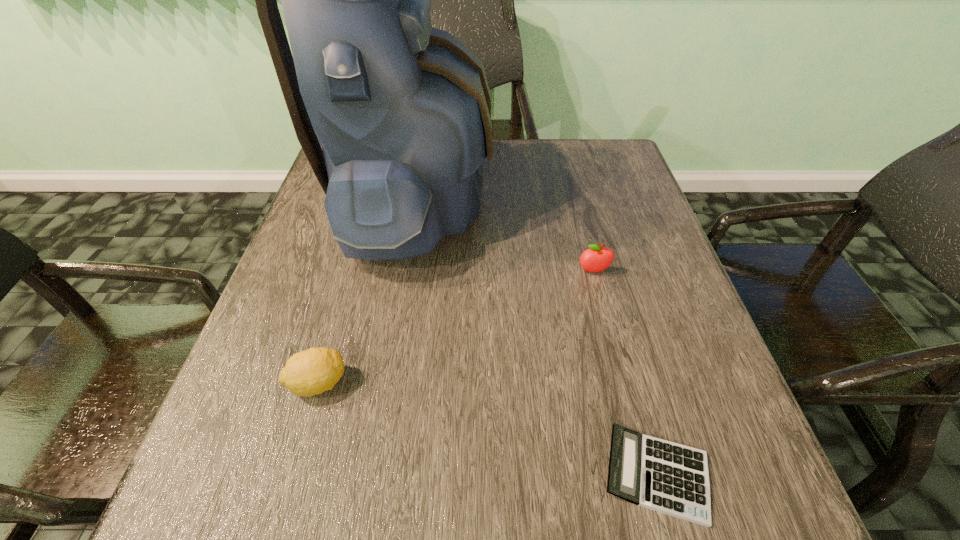
Locate an element on the screen. the tallest object is located at coordinates (402, 110).

You are a GUI agent. You are given a task and a screenshot of the screen. Output one action in this format:
    pyautogui.click(x=<x>, y=<y>)
    Task: Click on the apple
    The height and width of the screenshot is (540, 960).
    Given the screenshot: What is the action you would take?
    pyautogui.click(x=596, y=259)

Where is `lemon`? Image resolution: width=960 pixels, height=540 pixels. lemon is located at coordinates (307, 373).

At what (x,y) coordinates should I click in order to perform the action: click on calculator. Please return your answer as a coordinate pair (x, y). The image size is (960, 540). Looking at the image, I should click on (664, 476).

Identify the location of the shortest object. This screenshot has height=540, width=960. (664, 476).

You are a GUI agent. You are given a task and a screenshot of the screen. Output one action in this format:
    pyautogui.click(x=<x>, y=<y>)
    Task: Click on the blank space located 0.330m at the front pocket of the backpack
    Image resolution: width=960 pixels, height=540 pixels.
    Given the screenshot: What is the action you would take?
    pyautogui.click(x=620, y=199)

The height and width of the screenshot is (540, 960). I want to click on free region located on the front of the apple, so click(640, 456).

Locate an element on the screen. The width and height of the screenshot is (960, 540). vacant space located 0.370m at the stem end of the lemon is located at coordinates (565, 383).

Locate an element on the screen. This screenshot has height=540, width=960. free space located 0.090m on the left of the nearest object is located at coordinates (540, 475).

Where is `object present at the far edge`? This screenshot has height=540, width=960. object present at the far edge is located at coordinates (402, 110).